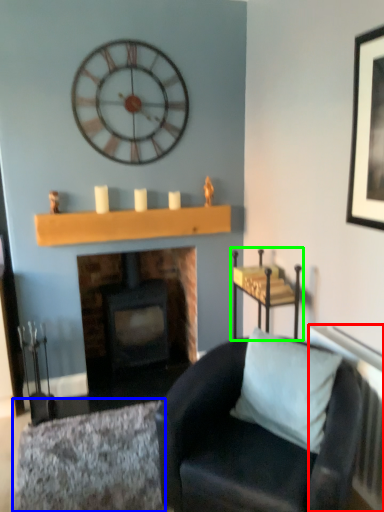
Question: Which is nearer to the radiator (highlighted by a red box)? plain (highlighted by a blue box) or furniture (highlighted by a green box).

Choices:
 (A) plain
 (B) furniture

Answer: (B)